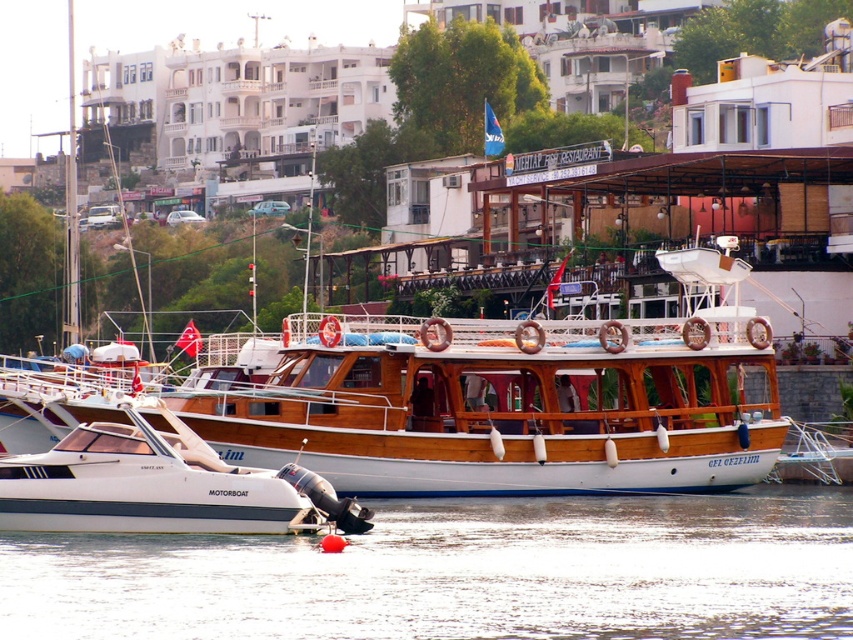
Question: Is white smooth water at lower center below white glossy motorboat at lower left?

Choices:
 (A) no
 (B) yes

Answer: (B)

Question: Which point is closer to the camera taking this photo?

Choices:
 (A) (809, 518)
 (B) (161, 452)

Answer: (B)

Question: Does white smooth water at lower center appear on the left side of white glossy motorboat at lower left?

Choices:
 (A) no
 (B) yes

Answer: (A)

Question: In this image, where is white smooth water at lower center located relative to white glossy motorboat at lower left?

Choices:
 (A) right
 (B) left

Answer: (A)

Question: Which point is farther to the camera?

Choices:
 (A) white smooth water at lower center
 (B) white glossy motorboat at lower left

Answer: (B)